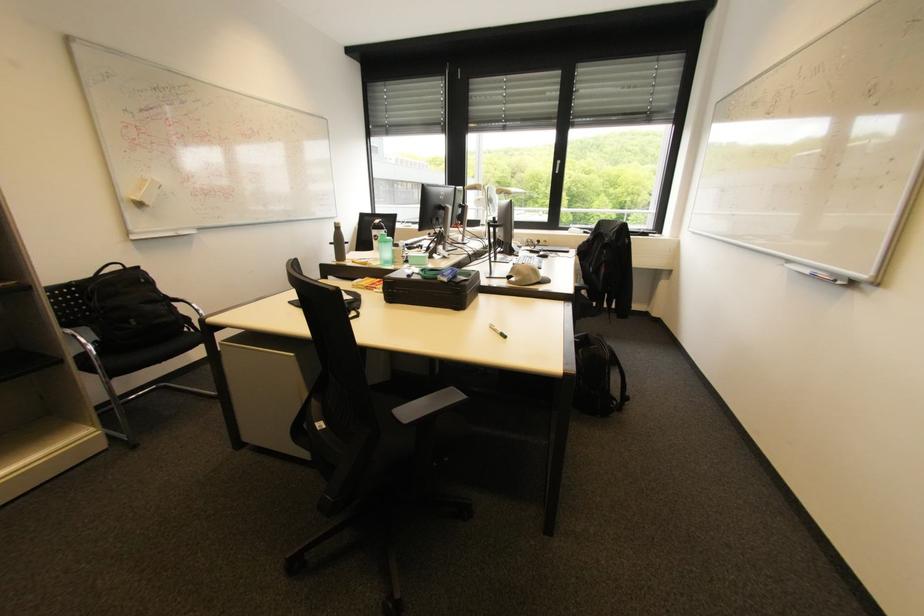
The location [817,273] corresponds to which object?

This point indicates the whiteboard marker.